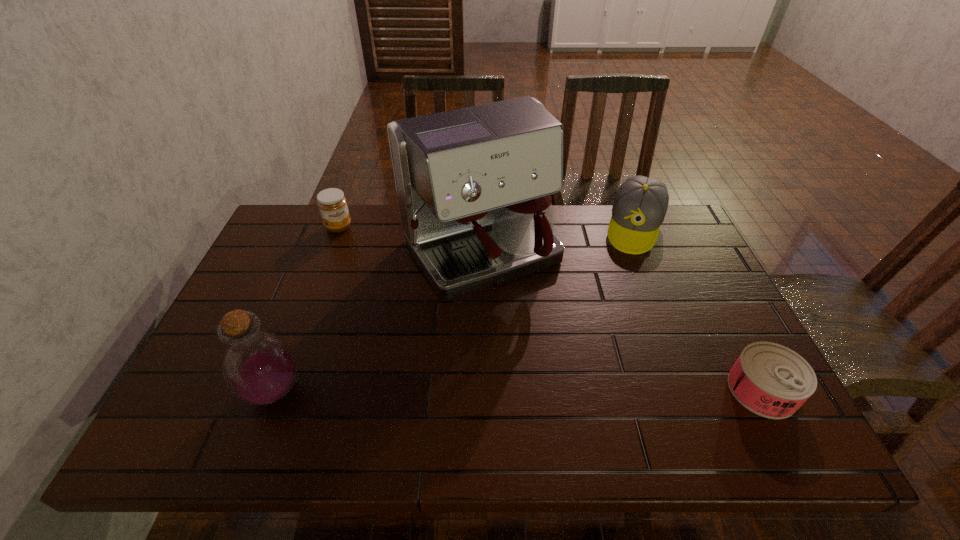
The width and height of the screenshot is (960, 540). I want to click on free space located 0.170m on the front of the tallest object near the spout, so click(x=551, y=354).

Locate an element on the screen. The width and height of the screenshot is (960, 540). free spot located 0.380m on the front label of the jam is located at coordinates (395, 309).

Where is `vacant space situated 0.380m on the front label of the jam`? vacant space situated 0.380m on the front label of the jam is located at coordinates (395, 309).

Image resolution: width=960 pixels, height=540 pixels. I want to click on vacant space located 0.270m on the front label of the jam, so click(377, 285).

You are a GUI agent. You are given a task and a screenshot of the screen. Output one action in this format:
    pyautogui.click(x=<x>, y=<y>)
    Task: Click on the free point located on the front-facing side of the third shortest object
    The height and width of the screenshot is (540, 960).
    Given the screenshot: What is the action you would take?
    pyautogui.click(x=613, y=321)

I want to click on free location located 0.210m on the front-facing side of the third shortest object, so click(x=619, y=300).

Identify the location of blank space located on the front-facing side of the third shortest object. This screenshot has width=960, height=540. (626, 274).

Find the location of `coffee maker present at the far edge`. coffee maker present at the far edge is located at coordinates (474, 185).

Find the location of a particular element. The width and height of the screenshot is (960, 540). jam located at the far edge is located at coordinates (332, 204).

Locate an element on the screen. baseball cap present at the far edge is located at coordinates (640, 205).